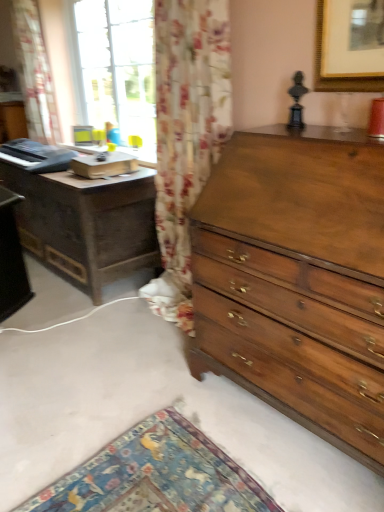
Question: Would you say floral fabric curtain at left contains dark wood nightstand at left?

Choices:
 (A) yes
 (B) no

Answer: (B)

Question: Can you confirm if floral fabric curtain at left is wider than dark wood nightstand at left?

Choices:
 (A) no
 (B) yes

Answer: (A)

Question: Can you confirm if floral fabric curtain at left is bigger than dark wood nightstand at left?

Choices:
 (A) yes
 (B) no

Answer: (B)

Question: Is floral fabric curtain at left next to dark wood nightstand at left?

Choices:
 (A) no
 (B) yes

Answer: (A)

Question: Can you confirm if floral fabric curtain at left is shorter than dark wood nightstand at left?

Choices:
 (A) no
 (B) yes

Answer: (A)

Question: Based on their positions, is floral fabric curtain at left located to the left or right of shiny brown wood chest of drawers at right?

Choices:
 (A) left
 (B) right

Answer: (A)

Question: Is point (26, 116) closer or farther from the camera than point (304, 152)?

Choices:
 (A) farther
 (B) closer

Answer: (A)

Question: Is floral fabric curtain at left in front of or behind shiny brown wood chest of drawers at right in the image?

Choices:
 (A) front
 (B) behind

Answer: (B)

Question: From their relative heights in the image, would you say floral fabric curtain at left is taller or shorter than shiny brown wood chest of drawers at right?

Choices:
 (A) short
 (B) tall

Answer: (B)

Question: Considering their positions, is shiny brown wood chest of drawers at right located in front of or behind floral fabric curtain at left?

Choices:
 (A) front
 (B) behind

Answer: (A)

Question: Does point pyautogui.click(x=266, y=150) appear closer or farther from the camera than point pyautogui.click(x=51, y=141)?

Choices:
 (A) closer
 (B) farther

Answer: (A)

Question: Considering the positions of shiny brown wood chest of drawers at right and floral fabric curtain at left in the image, is shiny brown wood chest of drawers at right taller or shorter than floral fabric curtain at left?

Choices:
 (A) tall
 (B) short

Answer: (B)

Question: From the image's perspective, is shiny brown wood chest of drawers at right located above or below floral fabric curtain at left?

Choices:
 (A) above
 (B) below

Answer: (B)

Question: From a real-world perspective, is floral fabric curtain at left positioned above or below dark wood nightstand at left?

Choices:
 (A) below
 (B) above

Answer: (B)

Question: Considering the positions of floral fabric curtain at left and dark wood nightstand at left in the image, is floral fabric curtain at left wider or thinner than dark wood nightstand at left?

Choices:
 (A) wide
 (B) thin

Answer: (B)